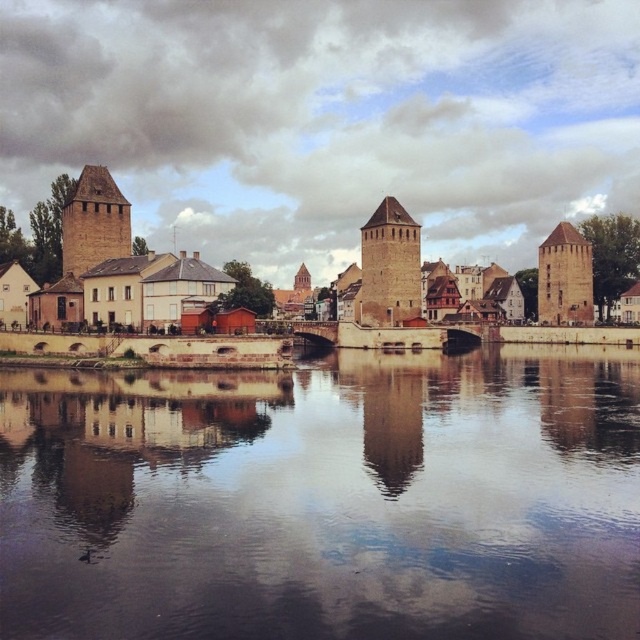
In the scene shown: Between brown stone tower at center and brown stone tower at right, which one appears on the right side from the viewer's perspective?

Positioned to the right is brown stone tower at right.

Is brown stone tower at center in front of brown stone tower at right?

That is True.

Is point (413, 307) positioned behind point (554, 243)?

No, (413, 307) is in front of (554, 243).

Find the location of a particular element. brown stone tower at center is located at coordinates (388, 266).

Does brown stone buildings at left have a greater width compared to brown stone tower at left?

Indeed, brown stone buildings at left has a greater width compared to brown stone tower at left.

Is point (115, 202) positioned behind point (61, 225)?

No.

This screenshot has width=640, height=640. What are the coordinates of `brown stone buildings at left` in the screenshot? It's located at (97, 259).

Between brown stone buildings at left and brown stone tower at right, which one appears on the left side from the viewer's perspective?

Positioned to the left is brown stone buildings at left.

Is brown stone buildings at left positioned in front of brown stone tower at right?

Yes, it is in front of brown stone tower at right.

Is point (65, 204) positioned in front of point (556, 243)?

That is True.

Find the location of a particular element. brown stone buildings at left is located at coordinates (97, 259).